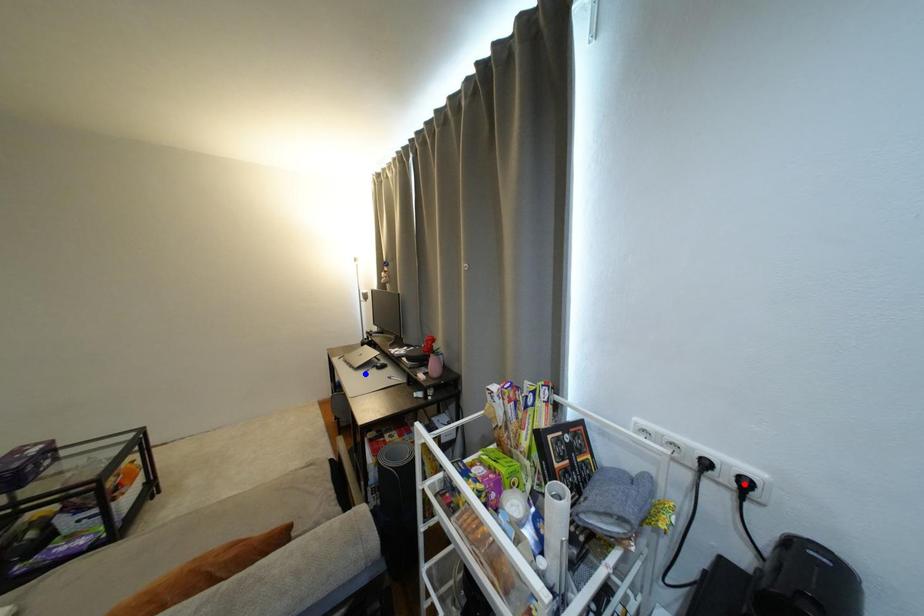
Question: Two points are marked on the image. Which point is closer to the camera?

Choices:
 (A) Blue point is closer.
 (B) Red point is closer.

Answer: (B)